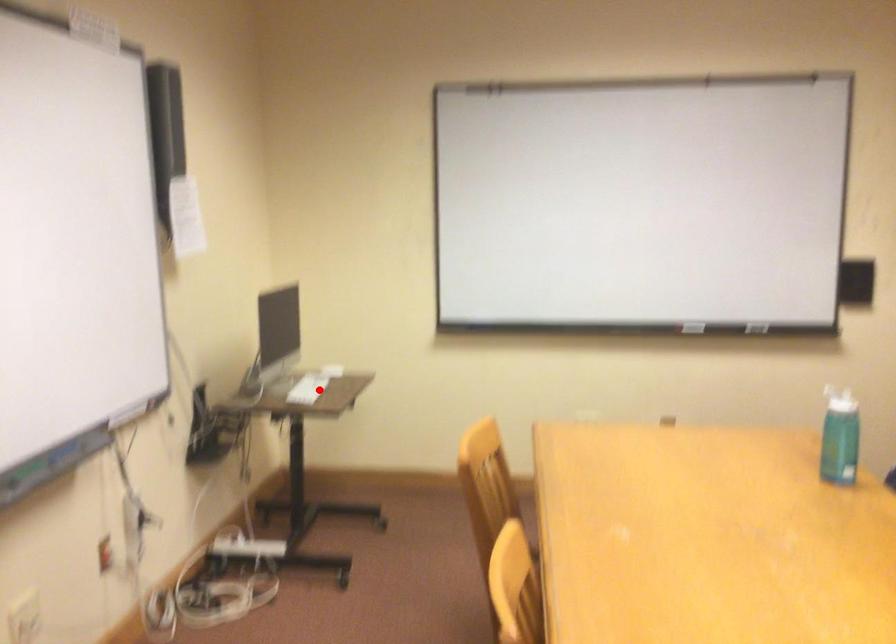
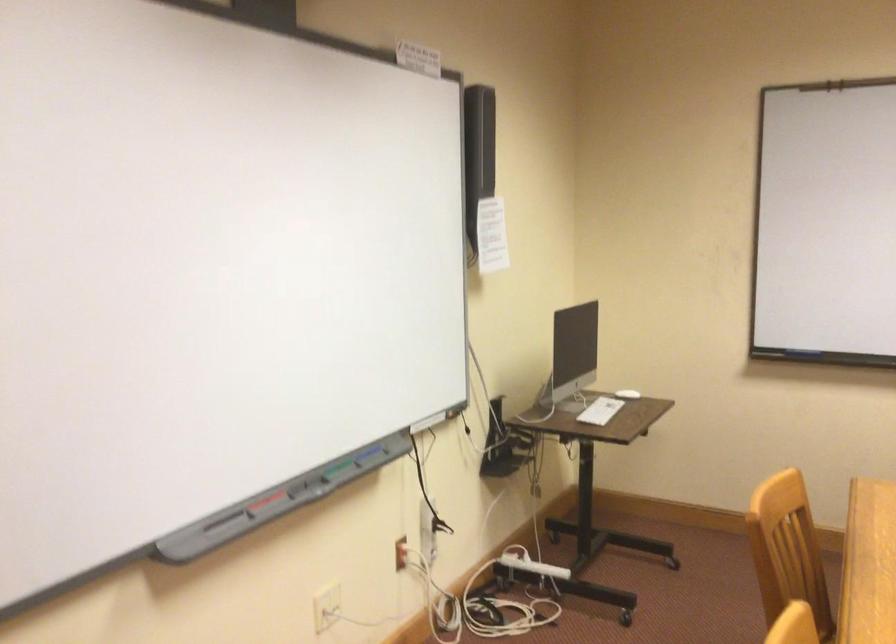
Locate, in the second image, the point that corresponds to the highlighted location in the first image.

(600, 410)